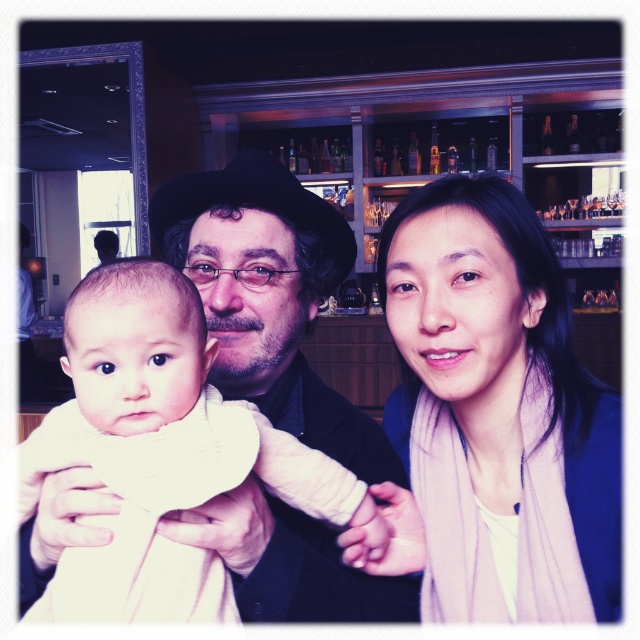
You are a photographer taking a picture of the pink scarf at center and the white soft cloth at center. Which object will appear closer to you in the photo?

The pink scarf at center will appear closer to you in the photo because it is positioned further to the viewer than the white soft cloth at center.

From the picture: You are standing in a bar and want to take a photo of the point at coordinate point (x=570, y=442). The camera you are using has a minimum focus distance of 30 inches. Will the camera be able to focus on the point?

The point at coordinate point (x=570, y=442) is 29.80 inches from the camera. Since the minimum focus distance is 30 inches, the camera will not be able to focus on the point as it is slightly closer than the required distance.

You are a photographer trying to capture a closeup of the pink scarf at center and the white soft cloth at center. Which object is located to the right of the other?

The pink scarf at center is positioned on the right side of white soft cloth at center.